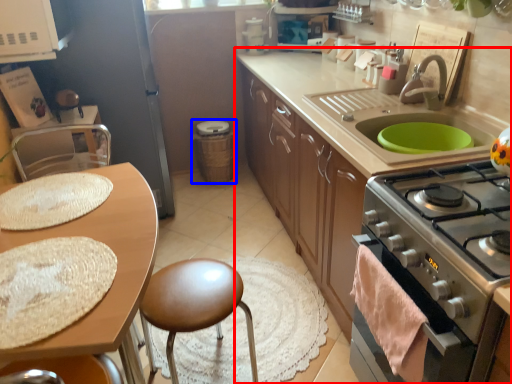
Question: Which object is further to the camera taking this photo, cabinetry (highlighted by a red box) or appliance (highlighted by a blue box)?

Choices:
 (A) cabinetry
 (B) appliance

Answer: (B)